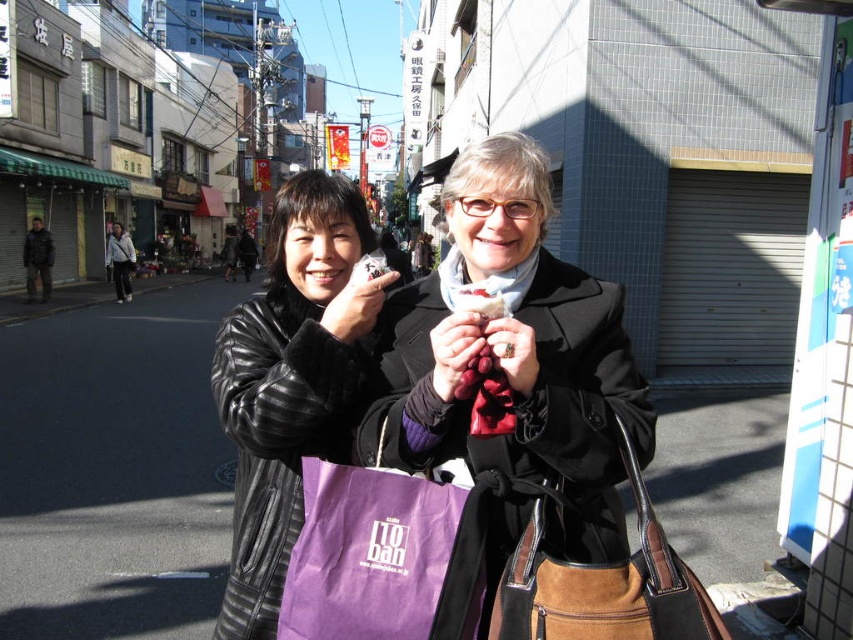
Question: Which of the following is the farthest from the observer?

Choices:
 (A) dark brown leather jacket at left
 (B) purple fabric bag at center

Answer: (A)

Question: Which of the following is the closest to the observer?

Choices:
 (A) purple fabric bag at center
 (B) leather jacket at center
 (C) black leather jacket at center
 (D) brown suede bag at lower right

Answer: (D)

Question: Estimate the real-world distances between objects in this image. Which object is closer to the purple fabric bag at center?

Choices:
 (A) dark brown leather jacket at left
 (B) brown suede bag at lower right
 (C) leather jacket at center

Answer: (C)

Question: Does leather jacket at center appear on the right side of purple fabric bag at center?

Choices:
 (A) no
 (B) yes

Answer: (B)

Question: Can you confirm if leather jacket at center is bigger than black leather jacket at center?

Choices:
 (A) yes
 (B) no

Answer: (A)

Question: Is black leather jacket at center positioned behind purple fabric bag at center?

Choices:
 (A) yes
 (B) no

Answer: (A)